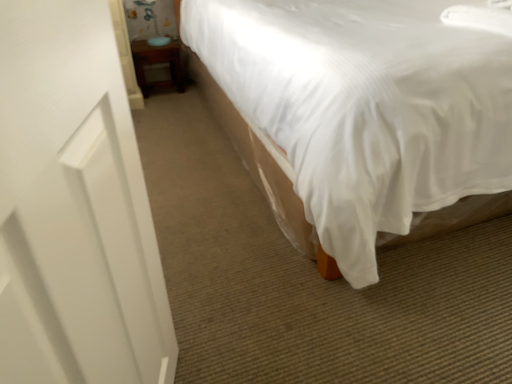
Identify the location of free space above wooden table at lower left (from a real-world perspective). (156, 43).